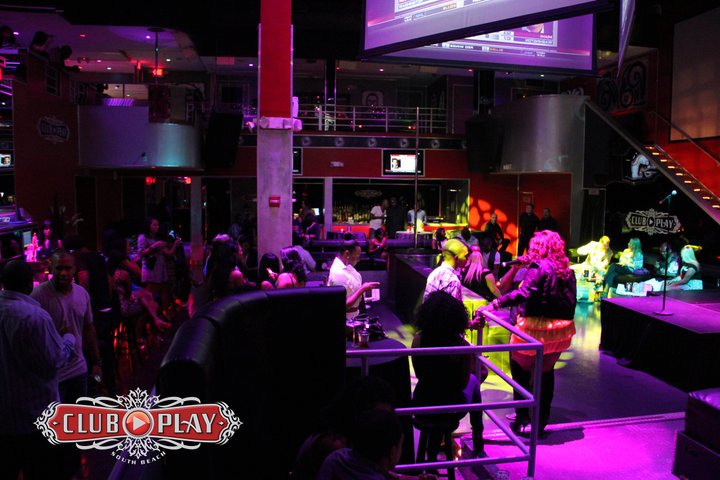
The image size is (720, 480). Find the location of `fire alarm`. fire alarm is located at coordinates (271, 200).